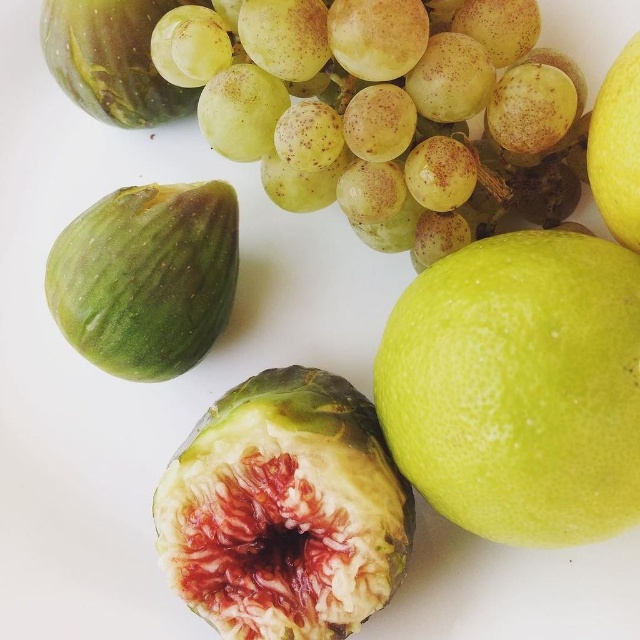
Based on the photo, who is lower down, green matte fig at left or yellow matte lemon at upper right?

Positioned lower is green matte fig at left.

Does point (129, 218) come closer to viewer compared to point (632, 45)?

No, it is not.

You are a GUI agent. You are given a task and a screenshot of the screen. Output one action in this format:
    pyautogui.click(x=<x>, y=<y>)
    Task: Click on the green matte fig at left
    The width and height of the screenshot is (640, 640).
    Given the screenshot: What is the action you would take?
    pyautogui.click(x=147, y=276)

Does ripe red fig at center lie behind yellow matte lemon at upper right?

Yes, ripe red fig at center is behind yellow matte lemon at upper right.

Does ripe red fig at center have a lesser height compared to yellow matte lemon at upper right?

No, ripe red fig at center is not shorter than yellow matte lemon at upper right.

Which is behind, point (253, 566) or point (634, 230)?

Point (253, 566)

At what (x,y) coordinates should I click in order to perform the action: click on ripe red fig at center. Please return your answer as a coordinate pair (x, y). Looking at the image, I should click on (284, 509).

Does point (276, 394) come closer to viewer compared to point (184, 276)?

Yes, point (276, 394) is in front of point (184, 276).

Where is `ripe red fig at center`? ripe red fig at center is located at coordinates (284, 509).